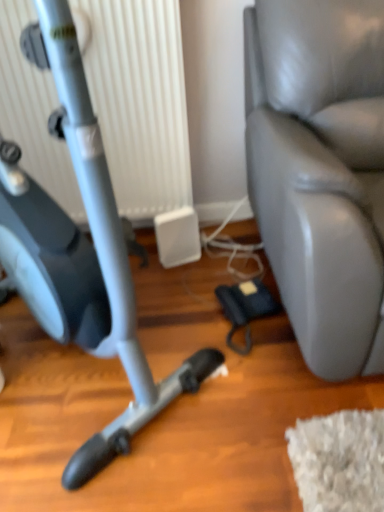
Question: From the image's perspective, is matte gray stationary bicycle at left above or below white plastic radiator at upper left?

Choices:
 (A) below
 (B) above

Answer: (A)

Question: Is point (18, 182) closer or farther from the camera than point (11, 93)?

Choices:
 (A) closer
 (B) farther

Answer: (A)

Question: Which object is the farthest from the matte gray stationary bicycle at left?

Choices:
 (A) white plastic radiator at upper left
 (B) leather swivel chair at right

Answer: (A)

Question: Considering the real-world distances, which object is closest to the matte gray stationary bicycle at left?

Choices:
 (A) leather swivel chair at right
 (B) white plastic radiator at upper left

Answer: (A)